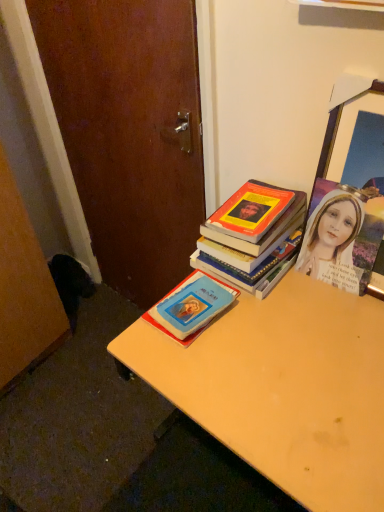
Identify the location of vacant area to the right of blue matte book at center, the first book ordered from the bottom. (281, 320).